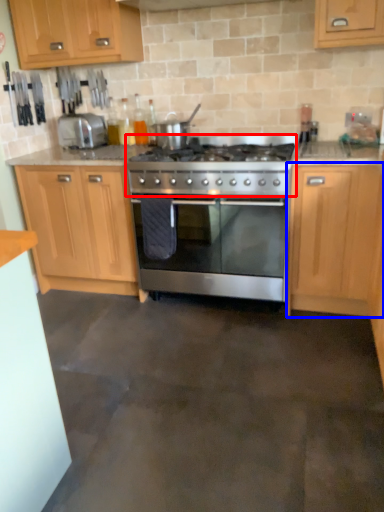
Question: Which of the following is the farthest to the observer, gas stove (highlighted by a red box) or cabinetry (highlighted by a blue box)?

Choices:
 (A) gas stove
 (B) cabinetry

Answer: (A)